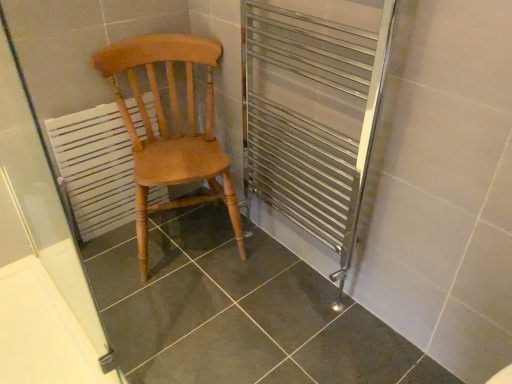
What do you see at coordinates (173, 128) in the screenshot?
I see `light brown wood chair at center` at bounding box center [173, 128].

This screenshot has height=384, width=512. What are the coordinates of `white painted wood radiator at left` in the screenshot? It's located at (94, 168).

Can you confirm if white painted wood radiator at left is taller than white matte screen door at left?

Incorrect, the height of white painted wood radiator at left is not larger of that of white matte screen door at left.

From a real-world perspective, between white painted wood radiator at left and white matte screen door at left, who is vertically lower?

From a 3D spatial view, white painted wood radiator at left is below.

Based on the photo, is white painted wood radiator at left facing towards white matte screen door at left?

Yes.

Which object is thinner, white painted wood radiator at left or white matte screen door at left?

Thinner between the two is white matte screen door at left.

Which is more to the left, white matte screen door at left or white painted wood radiator at left?

white painted wood radiator at left.

Is white matte screen door at left spatially inside white painted wood radiator at left, or outside of it?

white matte screen door at left exists outside the volume of white painted wood radiator at left.

From a real-world perspective, between white matte screen door at left and white painted wood radiator at left, who is vertically higher?

white matte screen door at left.

Can you confirm if white matte screen door at left is smaller than white painted wood radiator at left?

No.

How much distance is there between light brown wood chair at center and white painted wood radiator at left?

They are 8.76 inches apart.

From a real-world perspective, is light brown wood chair at center positioned under white painted wood radiator at left based on gravity?

No.

Is light brown wood chair at center looking in the opposite direction of white painted wood radiator at left?

No, light brown wood chair at center is not facing away from white painted wood radiator at left.

Would you say light brown wood chair at center is part of white painted wood radiator at left's contents?

No, light brown wood chair at center is not surrounded by white painted wood radiator at left.

Is white painted wood radiator at left behind light brown wood chair at center?

That is True.

Is white painted wood radiator at left facing away from light brown wood chair at center?

No, white painted wood radiator at left's orientation is not away from light brown wood chair at center.

Does white painted wood radiator at left have a greater width compared to light brown wood chair at center?

No, white painted wood radiator at left is not wider than light brown wood chair at center.

Which object is thinner, white matte screen door at left or light brown wood chair at center?

white matte screen door at left is thinner.

Which is more to the left, white matte screen door at left or light brown wood chair at center?

white matte screen door at left.

Is the depth of white matte screen door at left less than that of light brown wood chair at center?

Yes.

Is light brown wood chair at center at the right side of white matte screen door at left?

Yes.

Does point (190, 85) appear closer or farther from the camera than point (12, 127)?

Point (190, 85) is positioned farther from the camera compared to point (12, 127).

From a real-world perspective, between light brown wood chair at center and white matte screen door at left, who is vertically higher?

white matte screen door at left, from a real-world perspective.

Choose the correct answer: Is light brown wood chair at center inside white matte screen door at left or outside it?

light brown wood chair at center cannot be found inside white matte screen door at left.

Find the location of a particular element. This screenshot has width=512, height=384. screen door that appears in front of the white painted wood radiator at left is located at coordinates (42, 199).

This screenshot has width=512, height=384. Identify the location of radiator below the white matte screen door at left (from a real-world perspective). (94, 168).

Which object lies nearer to the anchor point light brown wood chair at center, white painted wood radiator at left or white matte screen door at left?

white painted wood radiator at left is closer to light brown wood chair at center.

Looking at the image, which one is located further to white matte screen door at left, light brown wood chair at center or white painted wood radiator at left?

light brown wood chair at center is positioned further to the anchor white matte screen door at left.

Looking at this image, when comparing their distances from light brown wood chair at center, does white matte screen door at left or white painted wood radiator at left seem further?

The object further to light brown wood chair at center is white matte screen door at left.

Based on their spatial positions, is white painted wood radiator at left or light brown wood chair at center further from white matte screen door at left?

light brown wood chair at center is positioned further to the anchor white matte screen door at left.

From the image, which object appears to be farther from white painted wood radiator at left, white matte screen door at left or light brown wood chair at center?

light brown wood chair at center is positioned further to the anchor white painted wood radiator at left.

In the scene shown: Estimate the real-world distances between objects in this image. Which object is further from white painted wood radiator at left, light brown wood chair at center or white matte screen door at left?

The object further to white painted wood radiator at left is light brown wood chair at center.

Where is `chair located between white matte screen door at left and white painted wood radiator at left in the depth direction`? This screenshot has width=512, height=384. chair located between white matte screen door at left and white painted wood radiator at left in the depth direction is located at coordinates (173, 128).